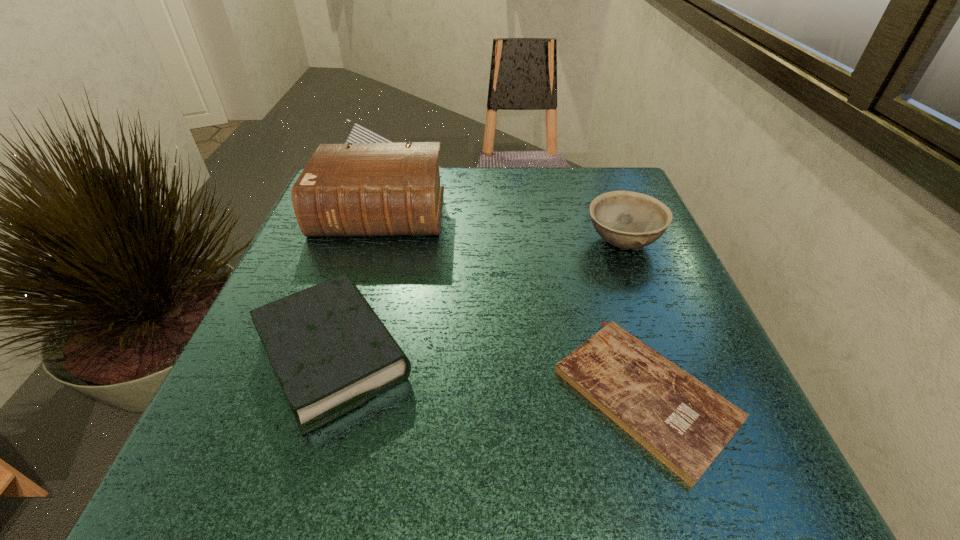
The width and height of the screenshot is (960, 540). I want to click on the tallest object, so click(365, 189).

You are a GUI agent. You are given a task and a screenshot of the screen. Output one action in this format:
    pyautogui.click(x=<x>, y=<y>)
    Task: Click on the farthest Bible
    
    Given the screenshot: What is the action you would take?
    pyautogui.click(x=365, y=189)

Locate an element on the screen. the third shortest object is located at coordinates (629, 220).

Image resolution: width=960 pixels, height=540 pixels. In order to click on the second tallest Bible in this screenshot , I will do `click(331, 353)`.

Identify the location of the rightmost Bible. Image resolution: width=960 pixels, height=540 pixels. (685, 424).

You are a GUI agent. You are given a task and a screenshot of the screen. Output one action in this format:
    pyautogui.click(x=<x>, y=<y>)
    Task: Click on the shortest Bible
    The height and width of the screenshot is (540, 960).
    Given the screenshot: What is the action you would take?
    pyautogui.click(x=685, y=424)

The width and height of the screenshot is (960, 540). In order to click on vacant space positioned 0.310m on the spine side of the farthest Bible in this screenshot , I will do `click(335, 363)`.

What are the coordinates of `free space located on the left of the third shortest object` in the screenshot? It's located at (471, 242).

Image resolution: width=960 pixels, height=540 pixels. I want to click on vacant space located 0.200m on the back of the second shortest Bible, so click(x=372, y=232).

In order to click on vacant space located on the left of the shortest object in this screenshot , I will do `click(457, 395)`.